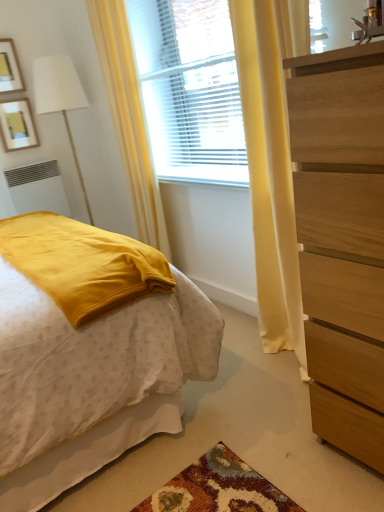
Where is `vacant space positioned to the left of wooden dresser at right`? This screenshot has height=512, width=384. vacant space positioned to the left of wooden dresser at right is located at coordinates (272, 439).